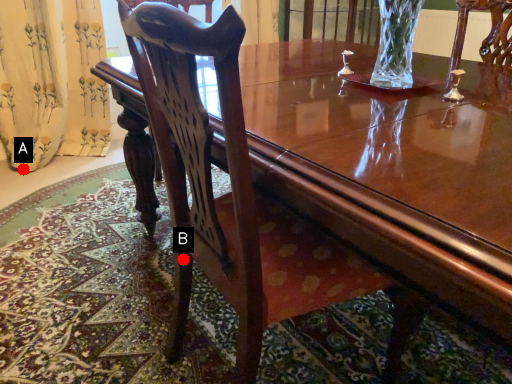
Question: Two points are circled on the image, labeled by A and B beside each circle. Which of the following is the farthest from the observer?

Choices:
 (A) A is further
 (B) B is further

Answer: (A)